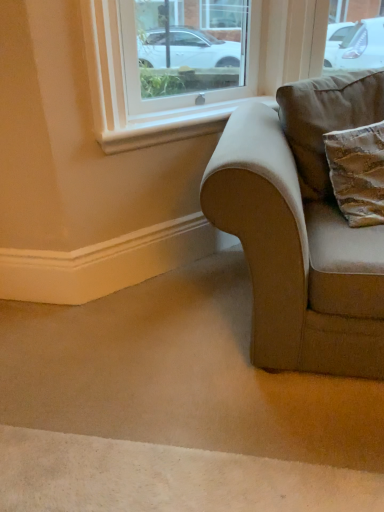
Find the location of a particular element. The height and width of the screenshot is (512, 384). velvet beige couch at lower right is located at coordinates (302, 228).

Identify the location of brown suede pillow at right. This screenshot has height=512, width=384. (326, 119).

What is the approximate height of brown suede pillow at right?

brown suede pillow at right is 23.23 inches tall.

The image size is (384, 512). I want to click on velvet beige couch at lower right, so click(x=302, y=228).

In the scene shown: From a real-world perspective, relative to brown suede pillow at right, is velvet beige couch at lower right vertically above or below?

From a real-world perspective, velvet beige couch at lower right is physically below brown suede pillow at right.

Between velvet beige couch at lower right and brown suede pillow at right, which one is positioned behind?

brown suede pillow at right is behind.

Is velvet beige couch at lower right in contact with brown suede pillow at right?

No, velvet beige couch at lower right is not in contact with brown suede pillow at right.

Considering the sizes of objects white smooth window sill at upper center and brown suede pillow at right in the image provided, who is smaller, white smooth window sill at upper center or brown suede pillow at right?

With smaller size is white smooth window sill at upper center.

Is white smooth window sill at upper center oriented away from brown suede pillow at right?

No, white smooth window sill at upper center is not facing away from brown suede pillow at right.

The height and width of the screenshot is (512, 384). In order to click on window sill directly beneath the brown suede pillow at right (from a real-world perspective) in this screenshot , I will do `click(172, 126)`.

Consider the image. Does white smooth window sill at upper center touch brown suede pillow at right?

white smooth window sill at upper center and brown suede pillow at right are clearly separated.

Does velvet beige couch at lower right have a greater width compared to white smooth window sill at upper center?

Correct, the width of velvet beige couch at lower right exceeds that of white smooth window sill at upper center.

Is velvet beige couch at lower right with white smooth window sill at upper center?

No, velvet beige couch at lower right is not with white smooth window sill at upper center.

Does point (325, 198) come farther from viewer compared to point (159, 131)?

No, it is not.

Considering the relative sizes of velvet beige couch at lower right and white smooth window sill at upper center in the image provided, is velvet beige couch at lower right shorter than white smooth window sill at upper center?

No, velvet beige couch at lower right is not shorter than white smooth window sill at upper center.

Can you tell me how much brown suede pillow at right and velvet beige couch at lower right differ in facing direction?

11.2 degrees separate the facing orientations of brown suede pillow at right and velvet beige couch at lower right.

Does brown suede pillow at right touch velvet beige couch at lower right?

No.

Considering the sizes of objects brown suede pillow at right and velvet beige couch at lower right in the image provided, who is bigger, brown suede pillow at right or velvet beige couch at lower right?

velvet beige couch at lower right is bigger.

I want to click on pillow above the velvet beige couch at lower right (from the image's perspective), so click(326, 119).

Is point (108, 139) positioned before point (260, 153)?

That is False.

Is white smooth window sill at upper center far away from velvet beige couch at lower right?

No.

Looking at the image, does white smooth window sill at upper center seem bigger or smaller compared to velvet beige couch at lower right?

white smooth window sill at upper center is smaller than velvet beige couch at lower right.

From a real-world perspective, is brown suede pillow at right physically above white smooth window sill at upper center?

Yes, from a real-world perspective, brown suede pillow at right is above white smooth window sill at upper center.

Is brown suede pillow at right further to camera compared to white smooth window sill at upper center?

No, it is in front of white smooth window sill at upper center.

What's the angular difference between brown suede pillow at right and white smooth window sill at upper center's facing directions?

brown suede pillow at right and white smooth window sill at upper center are facing 33.8 degrees away from each other.

Is brown suede pillow at right positioned beyond the bounds of white smooth window sill at upper center?

Indeed, brown suede pillow at right is completely outside white smooth window sill at upper center.

Locate an element on the screen. The image size is (384, 512). studio couch in front of the brown suede pillow at right is located at coordinates (302, 228).

Where is `window sill below the brown suede pillow at right (from a real-world perspective)`? The height and width of the screenshot is (512, 384). window sill below the brown suede pillow at right (from a real-world perspective) is located at coordinates (172, 126).

When comparing their distances from white smooth window sill at upper center, does velvet beige couch at lower right or brown suede pillow at right seem closer?

brown suede pillow at right lies closer to white smooth window sill at upper center than the other object.

From the image, which object appears to be farther from brown suede pillow at right, velvet beige couch at lower right or white smooth window sill at upper center?

Among the two, white smooth window sill at upper center is located further to brown suede pillow at right.

Estimate the real-world distances between objects in this image. Which object is closer to velvet beige couch at lower right, brown suede pillow at right or white smooth window sill at upper center?

brown suede pillow at right is closer to velvet beige couch at lower right.

Based on their spatial positions, is white smooth window sill at upper center or velvet beige couch at lower right further from brown suede pillow at right?

white smooth window sill at upper center is further to brown suede pillow at right.

From the image, which object appears to be nearer to velvet beige couch at lower right, white smooth window sill at upper center or brown suede pillow at right?

brown suede pillow at right lies closer to velvet beige couch at lower right than the other object.

When comparing their distances from white smooth window sill at upper center, does brown suede pillow at right or velvet beige couch at lower right seem closer?

The object closer to white smooth window sill at upper center is brown suede pillow at right.

At what (x,y) coordinates should I click in order to perform the action: click on pillow between velvet beige couch at lower right and white smooth window sill at upper center from front to back. Please return your answer as a coordinate pair (x, y). This screenshot has width=384, height=512. Looking at the image, I should click on (326, 119).